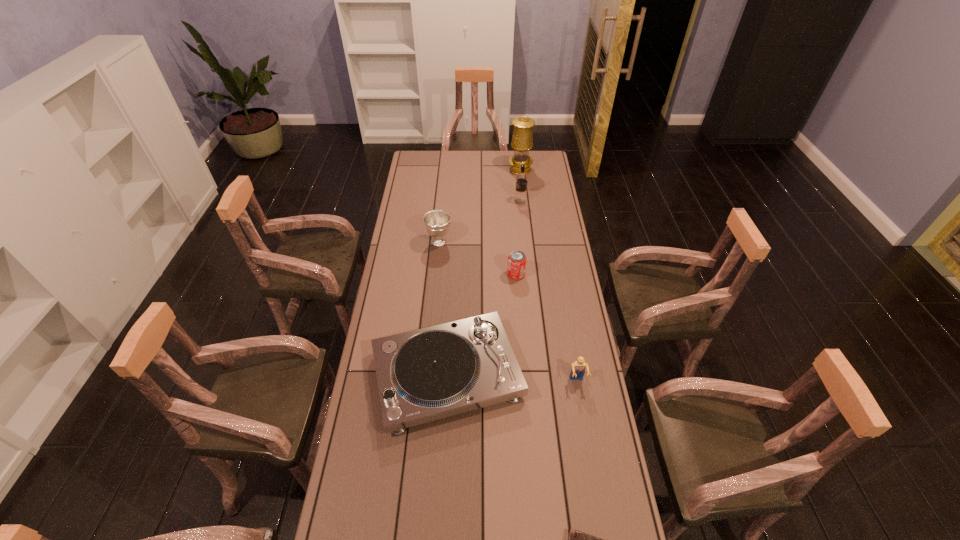
Find the location of a particular element. unoccupied position between the third tallest object and the Lego is located at coordinates (508, 312).

Where is `free spot between the fourth nearest object and the farthest object`? free spot between the fourth nearest object and the farthest object is located at coordinates click(518, 222).

At what (x,y) coordinates should I click in order to perform the action: click on empty location between the sixth shortest object and the fourth farthest object. Please return your answer as a coordinate pair (x, y). Looking at the image, I should click on (518, 238).

Locate an element on the screen. This screenshot has width=960, height=540. object that ranks as the closest to the oil lamp is located at coordinates (520, 198).

Identify which object is located as the third nearest to the oil lamp. Please provide its 2D coordinates. Your answer should be formatted as a tuple, i.e. [(x, y)], where the tuple contains the x and y coordinates of a point satisfying the conditions above.

[(516, 267)]

This screenshot has width=960, height=540. What are the coordinates of `free spot that satisfies the following two spatial constraints: 1. on the back side of the chalice; 2. on the left side of the tallest object` in the screenshot? It's located at tap(446, 170).